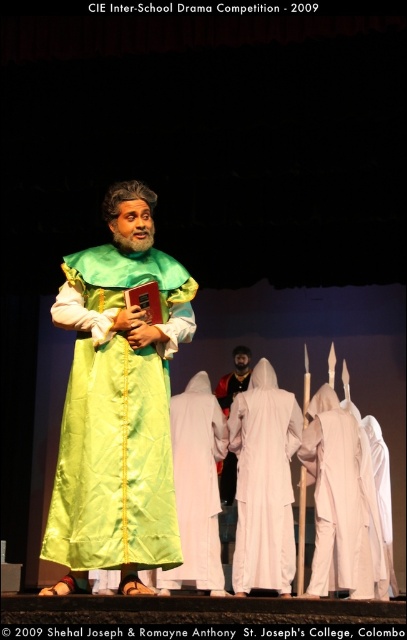
Question: Does green satin robe at center lie in front of red velvet cape at center?

Choices:
 (A) yes
 (B) no

Answer: (A)

Question: Considering the relative positions of white silk robe at center and red velvet cape at center in the image provided, where is white silk robe at center located with respect to red velvet cape at center?

Choices:
 (A) right
 (B) left

Answer: (A)

Question: Which object is the closest to the white matte robe at center?

Choices:
 (A) white silk robe at center
 (B) red velvet cape at center
 (C) white cotton robe at center
 (D) green satin robe at center

Answer: (A)

Question: Which object is the farthest from the white matte robe at center?

Choices:
 (A) red velvet cape at center
 (B) white silk robe at center
 (C) white cotton robe at center

Answer: (A)

Question: Does white silk robe at center have a lesser width compared to white cotton robe at center?

Choices:
 (A) no
 (B) yes

Answer: (A)

Question: Which object is the closest to the white cotton robe at center?

Choices:
 (A) red velvet cape at center
 (B) white silk robe at center
 (C) green satin robe at center
 (D) white matte robe at center

Answer: (B)